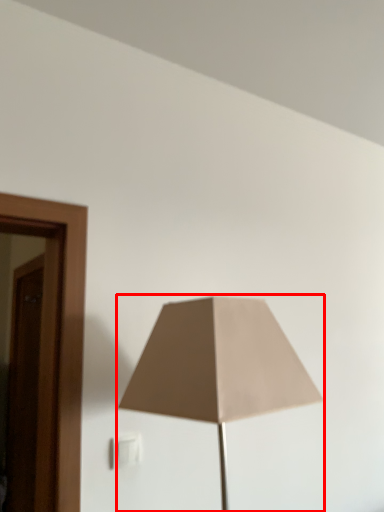
Question: From the image's perspective, what is the correct spatial positioning of lamp (annotated by the red box) in reference to electric outlet?

Choices:
 (A) below
 (B) above

Answer: (B)